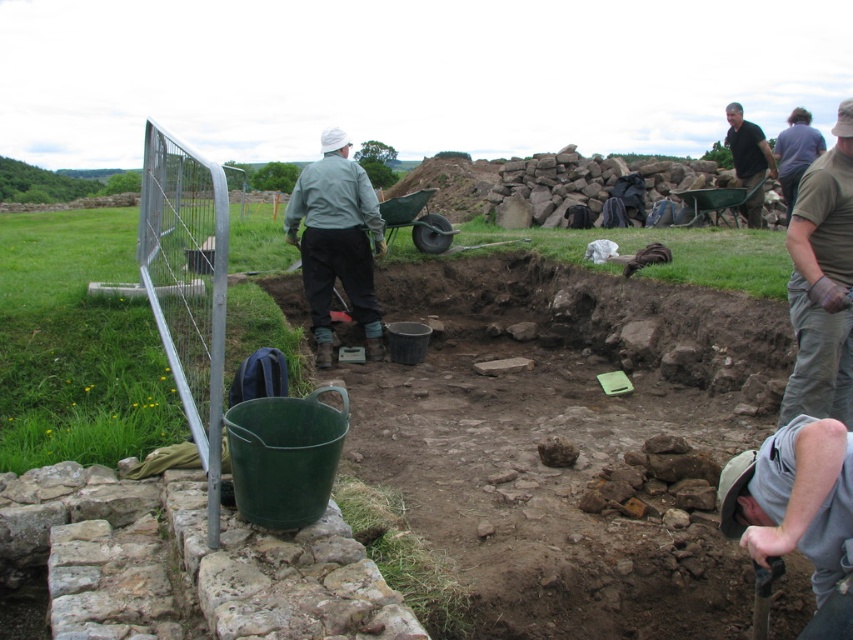
Is gray fabric shirt at lower right thinner than black cotton shirt at upper right?

Correct, gray fabric shirt at lower right's width is less than black cotton shirt at upper right's.

Does gray fabric shirt at lower right have a greater width compared to black cotton shirt at upper right?

No.

Locate an element on the screen. This screenshot has width=853, height=640. gray fabric shirt at lower right is located at coordinates (798, 512).

Between green cotton shirt at upper right and black cotton shirt at upper right, which one is positioned higher?

Positioned higher is black cotton shirt at upper right.

Does point (827, 182) come behind point (747, 198)?

No, (827, 182) is closer to viewer.

Measure the distance between point (x=808, y=237) and camera.

A distance of 4.14 meters exists between point (x=808, y=237) and camera.

You are a GUI agent. You are given a task and a screenshot of the screen. Output one action in this format:
    pyautogui.click(x=<x>, y=<y>)
    Task: Click on the green cotton shirt at upper right
    The height and width of the screenshot is (640, 853).
    Given the screenshot: What is the action you would take?
    pyautogui.click(x=822, y=284)

Which is below, gray fabric shirt at lower right or green cotton shirt at upper right?

Positioned lower is gray fabric shirt at lower right.

Between point (808, 525) and point (839, 248), which one is positioned behind?

The point (839, 248) is behind.

Which is in front, point (779, 545) or point (782, 401)?

Point (779, 545) is in front.

Image resolution: width=853 pixels, height=640 pixels. In order to click on gray fabric shirt at lower right in this screenshot , I will do `click(798, 512)`.